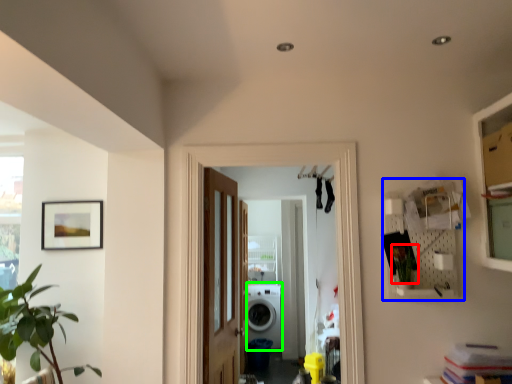
Question: Which is nearer to the plant (highlighted by a red box)? shelf (highlighted by a blue box) or washing machine (highlighted by a green box).

Choices:
 (A) shelf
 (B) washing machine

Answer: (A)